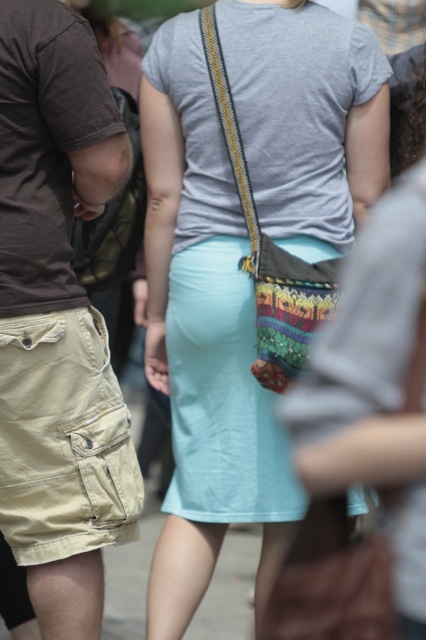
Question: Which object is farther from the camera taking this photo?

Choices:
 (A) tan cargo shorts at left
 (B) textured fabric skirt at center
 (C) tan/cotton shorts at left

Answer: (B)

Question: Considering the real-world distances, which object is closest to the multicolored woven bag at center?

Choices:
 (A) textured fabric skirt at center
 (B) tan/cotton shorts at left
 (C) tan cargo shorts at left

Answer: (A)

Question: Observing the image, what is the correct spatial positioning of textured fabric skirt at center in reference to tan cargo shorts at left?

Choices:
 (A) above
 (B) below

Answer: (A)

Question: Which of the following is the closest to the observer?

Choices:
 (A) (137, 477)
 (B) (216, 99)
 (C) (247, 20)

Answer: (C)

Question: Where is textured fabric skirt at center located in relation to multicolored woven bag at center in the image?

Choices:
 (A) above
 (B) below

Answer: (B)

Question: Does tan/cotton shorts at left have a smaller size compared to multicolored woven bag at center?

Choices:
 (A) no
 (B) yes

Answer: (B)